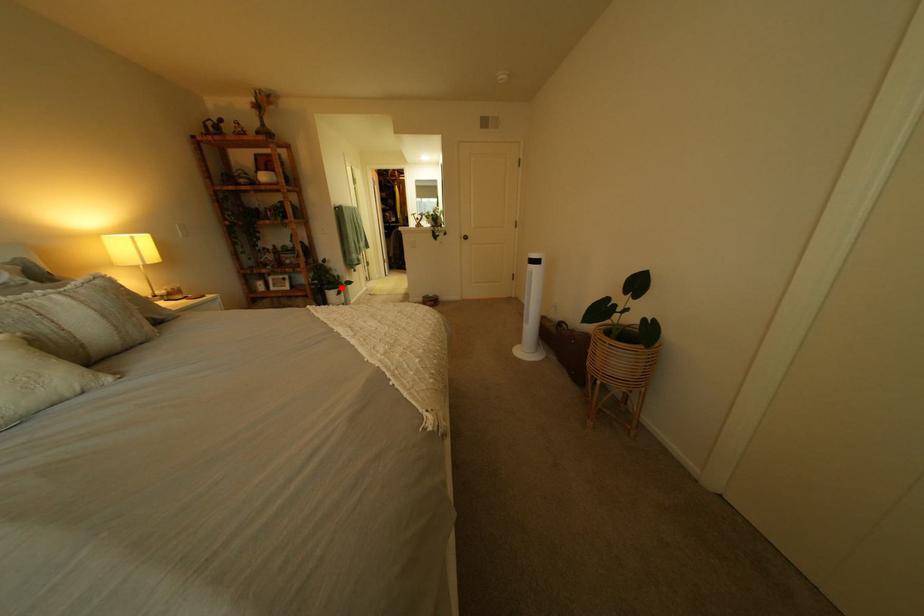
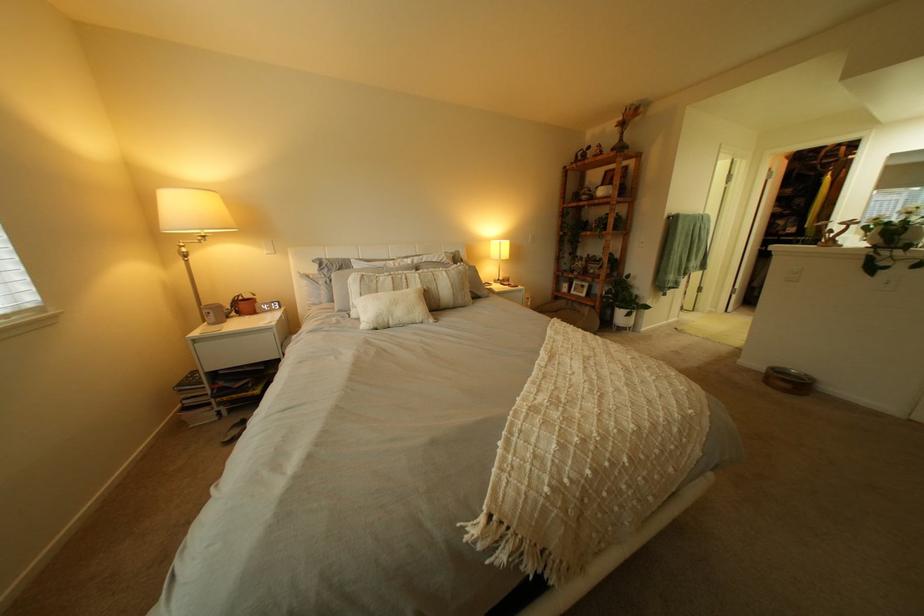
Where in the second image is the point corresponding to the highlighted location from the first image?

(633, 305)